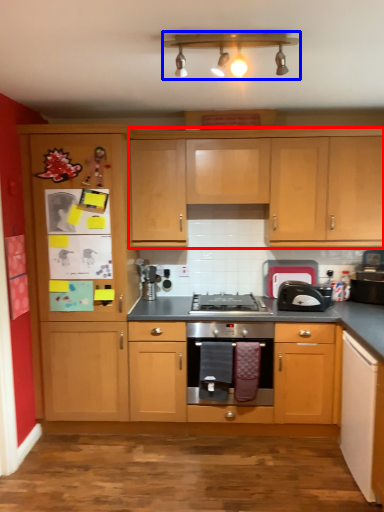
Question: Which object appears farthest to the camera in this image, cabinetry (highlighted by a red box) or light fixture (highlighted by a blue box)?

Choices:
 (A) cabinetry
 (B) light fixture

Answer: (A)